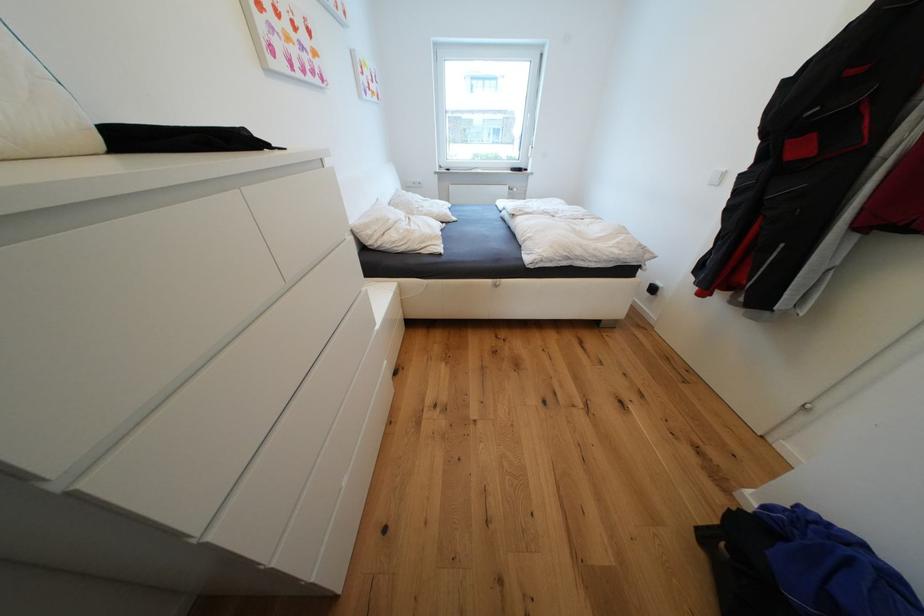
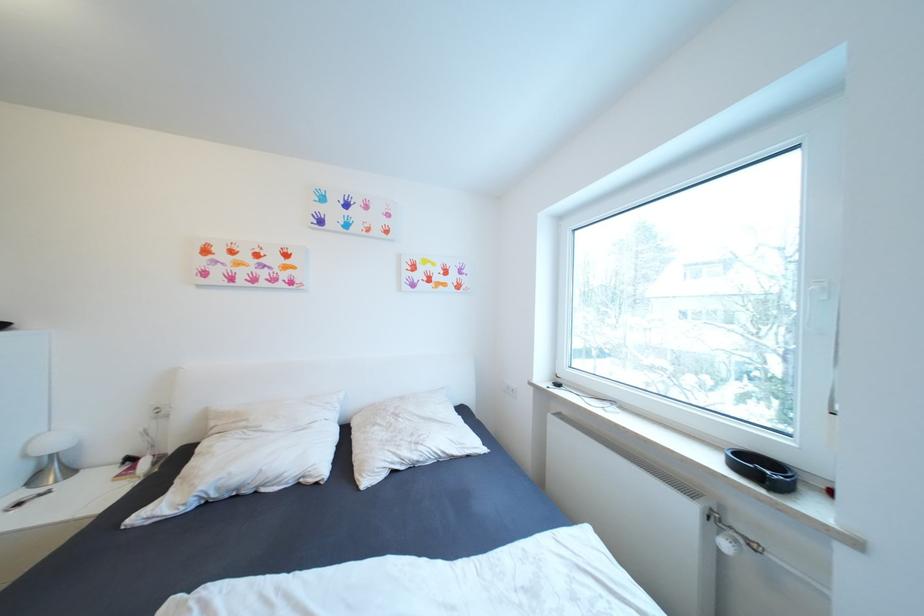
The point at (377, 233) is marked in the first image. Where is the corresponding point in the second image?

(220, 424)